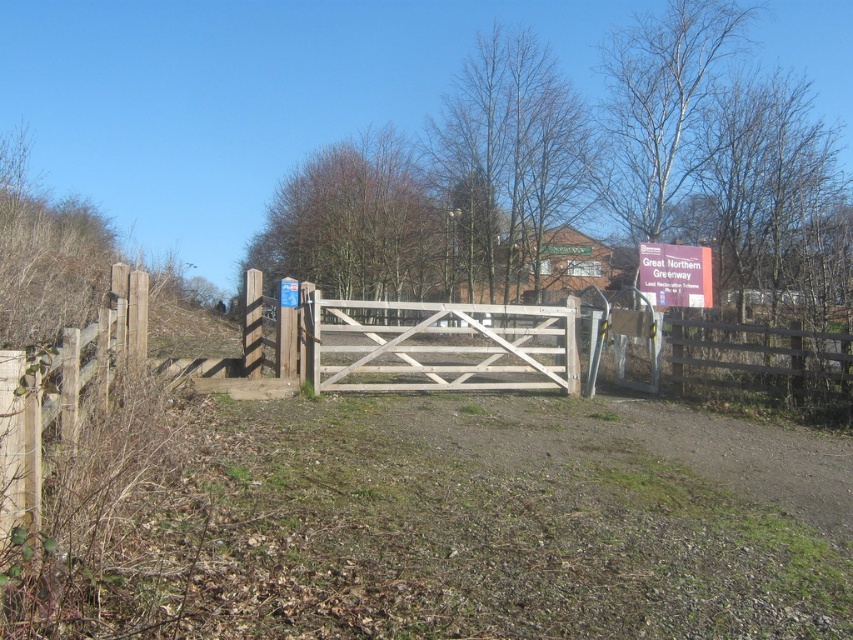
Between white wooden gate at center and purple matte sign at upper right, which one appears on the right side from the viewer's perspective?

From the viewer's perspective, purple matte sign at upper right appears more on the right side.

Describe the element at coordinates (439, 346) in the screenshot. I see `white wooden gate at center` at that location.

Find the location of `white wooden gate at center`. white wooden gate at center is located at coordinates (439, 346).